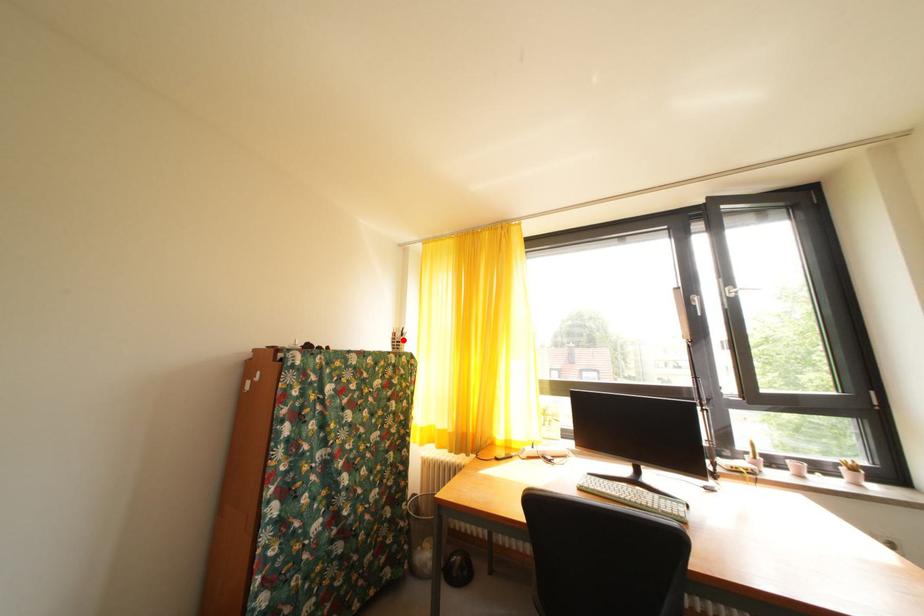
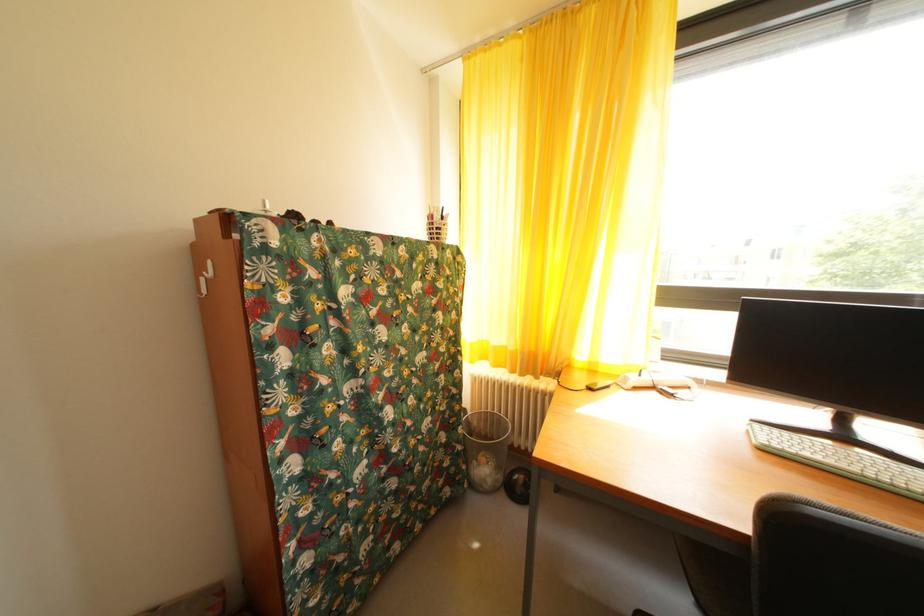
Question: I am providing you with two images of the same scene from different viewpoints. A red point is marked on the first image. Can you still see the location of the red point in image 2?

Choices:
 (A) Yes
 (B) No

Answer: (A)